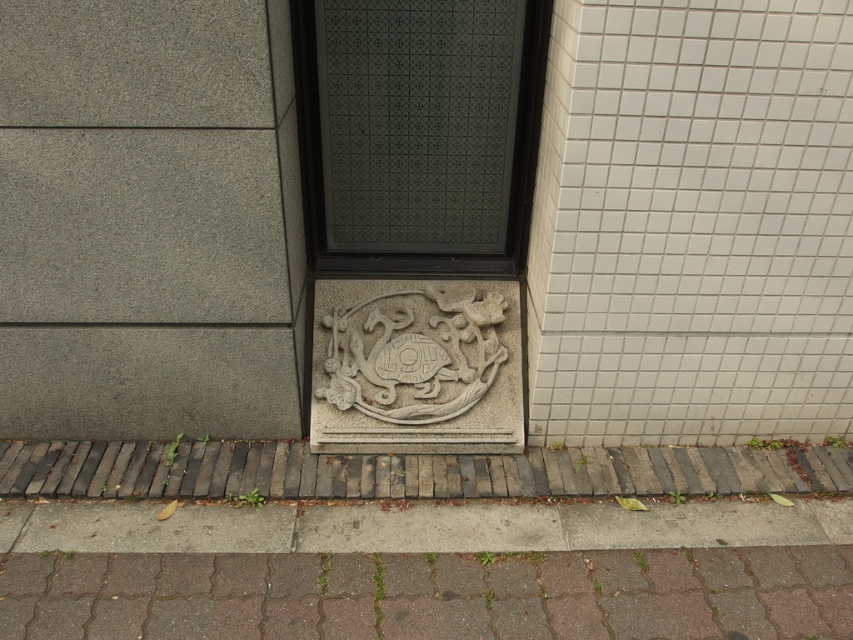
You are standing in front of the building and want to take a photo of the gray stone carving at center without the brown brick pavement at lower center appearing in the frame. Is this possible?

The brown brick pavement at lower center is in front of the gray stone carving at center, so it would block the view. To avoid including the brown brick pavement at lower center in the photo, you would need to move to a position where the gray stone carving at center is not obscured by the pavement. This might involve moving to the side or adjusting your angle so that the pavement is no longer between you and the carving.

You are standing in front of the building and notice the brown brick pavement at lower center and the gray stone carving at center. Which object is positioned to the right side from your viewpoint?

The brown brick pavement at lower center is to the right of the gray stone carving at center, so the brown brick pavement at lower center is positioned to the right side from your viewpoint.